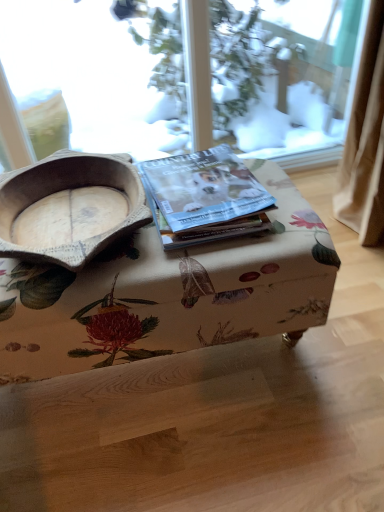
Question: Considering the positions of floral fabric ottoman at center and matte paper magazine at center in the image, is floral fabric ottoman at center taller or shorter than matte paper magazine at center?

Choices:
 (A) short
 (B) tall

Answer: (B)

Question: Is floral fabric ottoman at center bigger or smaller than matte paper magazine at center?

Choices:
 (A) big
 (B) small

Answer: (A)

Question: Considering the real-world distances, which object is closest to the floral fabric ottoman at center?

Choices:
 (A) wooden bowl at left
 (B) matte paper magazine at center

Answer: (B)

Question: Which of these objects is positioned closest to the matte paper magazine at center?

Choices:
 (A) floral fabric ottoman at center
 (B) wooden bowl at left

Answer: (A)